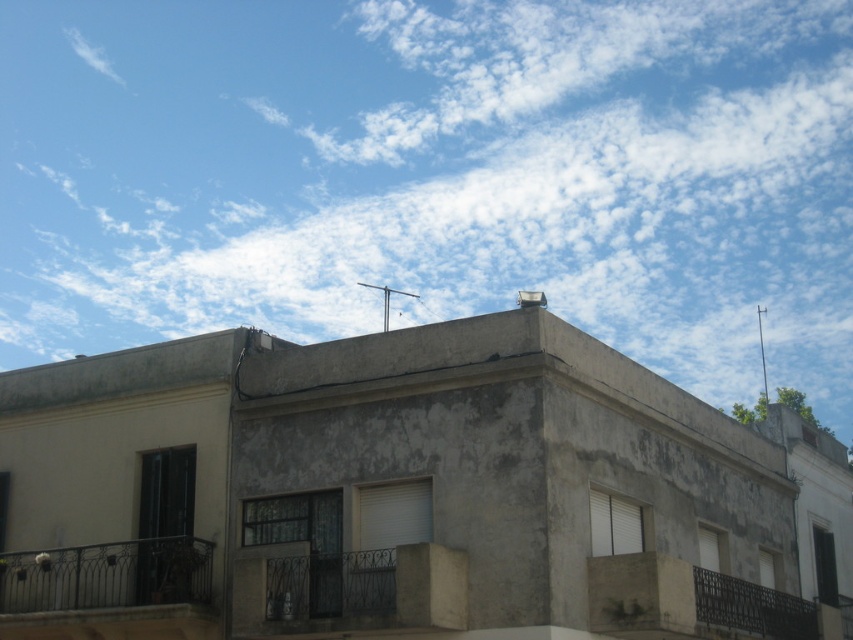
Which is more to the left, white fluffy cloud at upper center or dark gray metal balcony at center?

From the viewer's perspective, dark gray metal balcony at center appears more on the left side.

This screenshot has width=853, height=640. What do you see at coordinates (434, 176) in the screenshot? I see `white fluffy cloud at upper center` at bounding box center [434, 176].

In order to click on white fluffy cloud at upper center in this screenshot , I will do `click(434, 176)`.

Does point (3, 586) come behind point (367, 570)?

Yes, point (3, 586) is farther from viewer.

Is dark gray wrought iron balcony at lower left closer to the viewer compared to dark gray metal balcony at center?

That is False.

You are a GUI agent. You are given a task and a screenshot of the screen. Output one action in this format:
    pyautogui.click(x=<x>, y=<y>)
    Task: Click on the dark gray wrought iron balcony at lower left
    
    Given the screenshot: What is the action you would take?
    click(109, 592)

At what (x,y) coordinates should I click in order to perform the action: click on dark gray wrought iron balcony at lower left. Please return your answer as a coordinate pair (x, y). The width and height of the screenshot is (853, 640). Looking at the image, I should click on (109, 592).

Measure the distance from white fluffy cloud at upper center to black wrought iron balcony at lower right.

A distance of 152.10 meters exists between white fluffy cloud at upper center and black wrought iron balcony at lower right.

Which is in front, point (553, 304) or point (706, 596)?

Point (706, 596)

The width and height of the screenshot is (853, 640). In order to click on white fluffy cloud at upper center in this screenshot , I will do `click(434, 176)`.